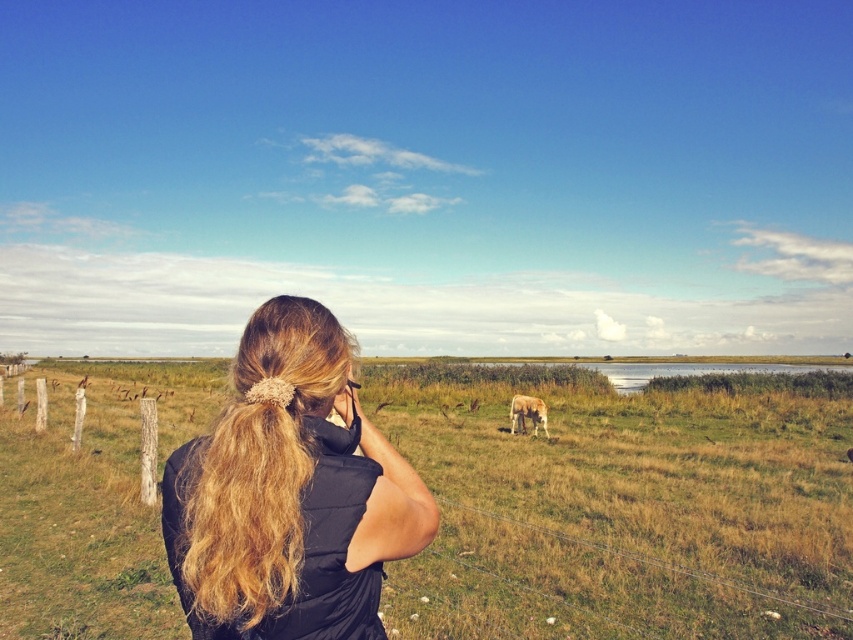
You are a photographer trying to capture a landscape shot of the green grass at center and the white fur horse at center. Which object should you focus on first if you want to ensure both are in sharp focus?

The green grass at center is bigger than the white fur horse at center, so focusing on the green grass at center first will help ensure both are in sharp focus since it is larger and occupies more of the frame.

What is the 2D coordinate of the green grass at center?

The 2D coordinate of the green grass at center is at point (622, 509).